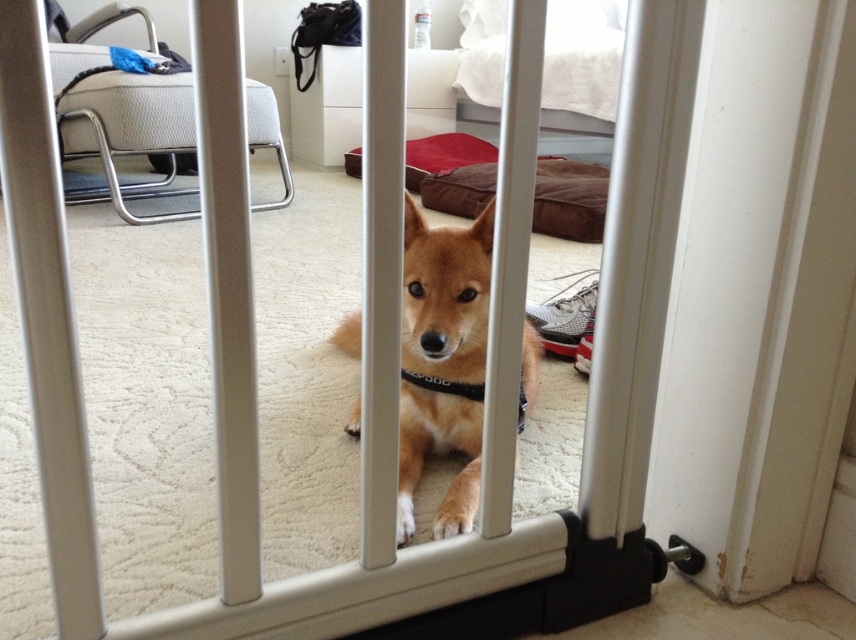
You see a golden fur dog at center and a brown plush dog bed at center in the room. Which one is positioned to the left?

The golden fur dog at center is positioned to the left of the brown plush dog bed at center.

You are a dog trainer observing the golden fur dog at center and the black fabric neckband at center. Based on their sizes, which one is more likely to fit through a narrow doorway without bending?

The golden fur dog at center might be wider than the black fabric neckband at center, so the neckband is more likely to fit through a narrow doorway without bending.

From the picture: You are a delivery person who needs to place a package on the floor in the room where the small dog is located. The package must be placed in an area that is not occupied by the brown plush dog bed at center. Where should you place the package?

The brown plush dog bed at center is located at point [569,198], so you should place the package in an area of the floor that is not at those coordinates to avoid occupying the brown plush dog bed at center.